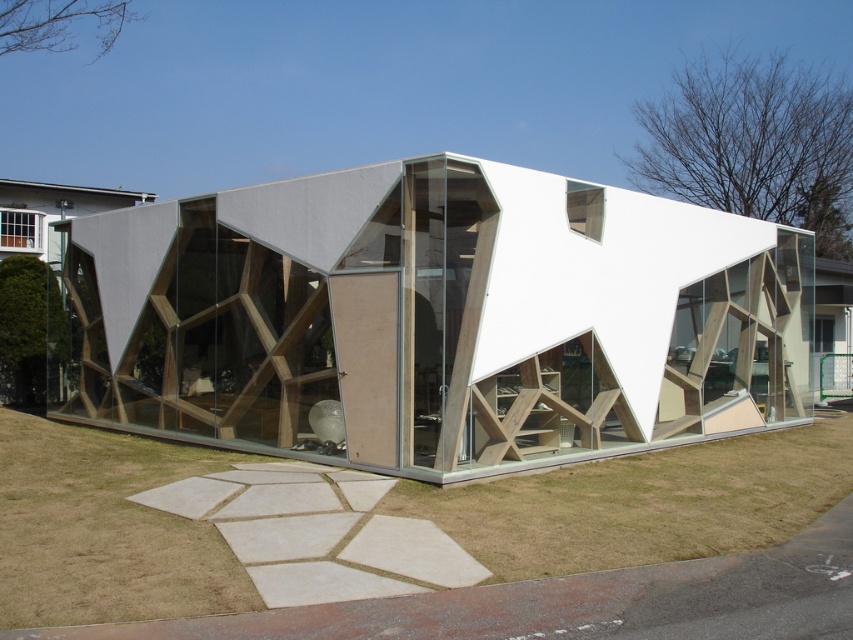
Is white matte wooden structure at center wider than green grass at lower center?

Yes, white matte wooden structure at center is wider than green grass at lower center.

Which is in front, point (410, 342) or point (56, 513)?

Positioned in front is point (56, 513).

Does point (613, 333) lie behind point (119, 522)?

That is True.

Locate an element on the screen. Image resolution: width=853 pixels, height=640 pixels. white matte wooden structure at center is located at coordinates (434, 317).